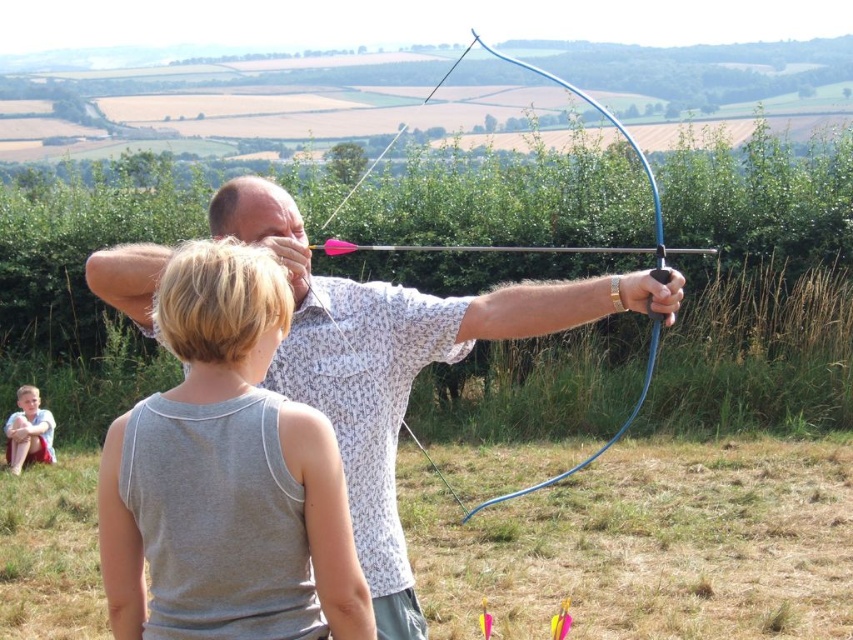
Question: Is gray cotton tank top at center positioned in front of matte white bow at center?

Choices:
 (A) yes
 (B) no

Answer: (A)

Question: Which object is the farthest from the light brown fabric shorts at lower left?

Choices:
 (A) gray cotton tank top at center
 (B) matte white bow at center
 (C) matte blue bow at center

Answer: (A)

Question: Estimate the real-world distances between objects in this image. Which object is closer to the matte white bow at center?

Choices:
 (A) light brown fabric shorts at lower left
 (B) matte blue bow at center
 (C) gray cotton tank top at center

Answer: (C)

Question: Can you confirm if matte blue bow at center is positioned below light brown fabric shorts at lower left?

Choices:
 (A) yes
 (B) no

Answer: (B)

Question: Which of the following is the farthest from the observer?

Choices:
 (A) gray cotton tank top at center
 (B) matte white bow at center
 (C) light brown fabric shorts at lower left

Answer: (C)

Question: Is gray cotton tank top at center positioned at the back of light brown fabric shorts at lower left?

Choices:
 (A) yes
 (B) no

Answer: (B)